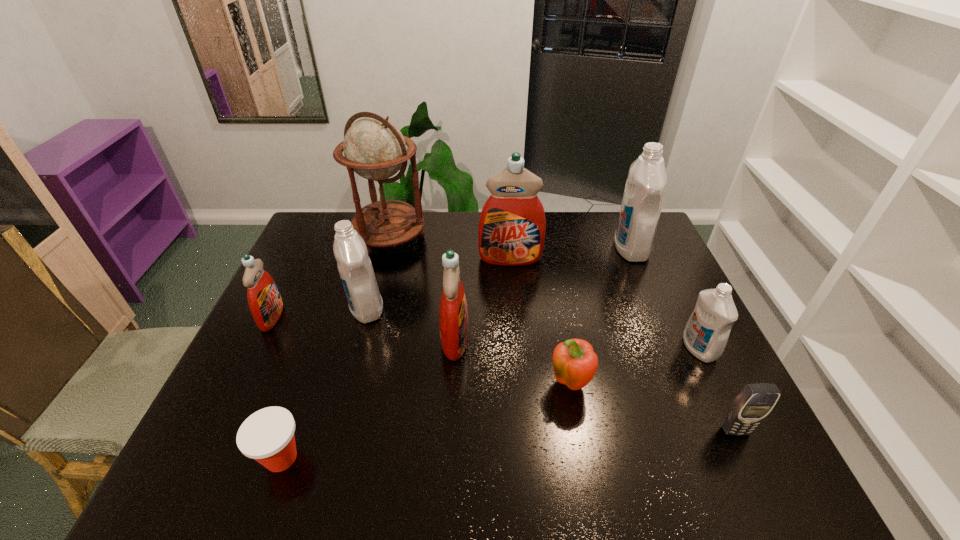
The image size is (960, 540). I want to click on cellular telephone that is at the right edge, so click(752, 405).

Identify the location of object at the near left corner. This screenshot has width=960, height=540. (267, 436).

Where is `object at the far right corner`? Image resolution: width=960 pixels, height=540 pixels. object at the far right corner is located at coordinates (644, 191).

In the image, there is a desktop. Where is `vacant space at the far edge`? Image resolution: width=960 pixels, height=540 pixels. vacant space at the far edge is located at coordinates (569, 221).

Identify the location of vacant region at the near edge of the desktop. (375, 468).

At what (x,y) coordinates should I click in order to perform the action: click on free point at the left edge. Please return your answer as a coordinate pair (x, y). This screenshot has width=960, height=540. Looking at the image, I should click on (232, 386).

I want to click on free space at the right edge, so click(x=690, y=368).

In order to click on free space at the far right corner of the desktop in this screenshot , I will do `click(654, 247)`.

In the image, there is a desktop. Where is `free space at the near right corner`? The width and height of the screenshot is (960, 540). free space at the near right corner is located at coordinates (772, 474).

This screenshot has height=540, width=960. Find the location of `free space between the fourth detergent from left to right and the red-orange Dixie cup`. free space between the fourth detergent from left to right and the red-orange Dixie cup is located at coordinates (396, 358).